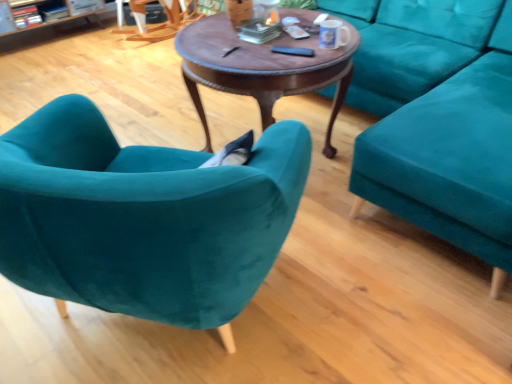
Question: Is teal velvet couch at right outside black matte remote control at center, which is counted as the 2th remote control, starting from the back?

Choices:
 (A) yes
 (B) no

Answer: (A)

Question: Are teal velvet couch at right and black matte remote control at center, arranged as the first remote control when ordered from the bottom, located far from each other?

Choices:
 (A) yes
 (B) no

Answer: (B)

Question: Does teal velvet couch at right come behind black matte remote control at center, arranged as the second remote control when viewed from the top?

Choices:
 (A) yes
 (B) no

Answer: (B)

Question: Considering the relative sizes of teal velvet couch at right and black matte remote control at center, which is the first remote control in front-to-back order, in the image provided, is teal velvet couch at right shorter than black matte remote control at center, which is the first remote control in front-to-back order,?

Choices:
 (A) yes
 (B) no

Answer: (B)

Question: Can you confirm if teal velvet couch at right is positioned to the right of black matte remote control at center, arranged as the first remote control when ordered from the bottom?

Choices:
 (A) yes
 (B) no

Answer: (A)

Question: Is teal velvet couch at right taller or shorter than white glossy mug at upper center?

Choices:
 (A) short
 (B) tall

Answer: (B)

Question: From a real-world perspective, is teal velvet couch at right physically located above or below white glossy mug at upper center?

Choices:
 (A) below
 (B) above

Answer: (A)

Question: Considering the positions of point (398, 18) and point (340, 41), is point (398, 18) closer or farther from the camera than point (340, 41)?

Choices:
 (A) closer
 (B) farther

Answer: (B)

Question: Relative to white glossy mug at upper center, is teal velvet couch at right in front or behind?

Choices:
 (A) behind
 (B) front

Answer: (B)

Question: Is point (147, 317) positioned closer to the camera than point (300, 29)?

Choices:
 (A) closer
 (B) farther

Answer: (A)

Question: In terms of width, does velvet teal armchair at left look wider or thinner when compared to white plastic remote control at center, the 2th remote control in the bottom-to-top sequence?

Choices:
 (A) thin
 (B) wide

Answer: (B)

Question: From the image's perspective, is velvet teal armchair at left positioned above or below white plastic remote control at center, which appears as the first remote control when viewed from the top?

Choices:
 (A) below
 (B) above

Answer: (A)

Question: Visually, is velvet teal armchair at left positioned to the left or to the right of white plastic remote control at center, the 2th remote control in the bottom-to-top sequence?

Choices:
 (A) left
 (B) right

Answer: (A)

Question: Is point (287, 26) positioned closer to the camera than point (150, 31)?

Choices:
 (A) farther
 (B) closer

Answer: (B)

Question: Considering the relative positions of white plastic remote control at center, arranged as the first remote control when viewed from the back, and wooden rocking chair at upper left in the image provided, is white plastic remote control at center, arranged as the first remote control when viewed from the back, to the left or to the right of wooden rocking chair at upper left?

Choices:
 (A) right
 (B) left

Answer: (A)